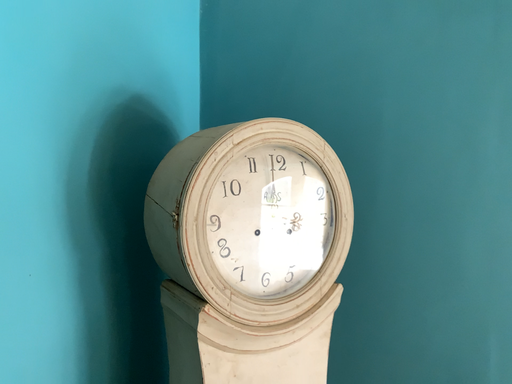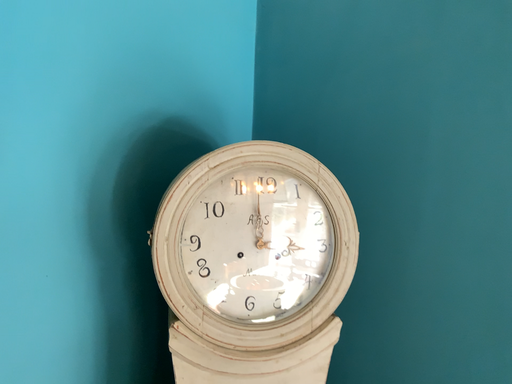
Question: Which way did the camera rotate in the video?

Choices:
 (A) rotated right
 (B) rotated left

Answer: (B)